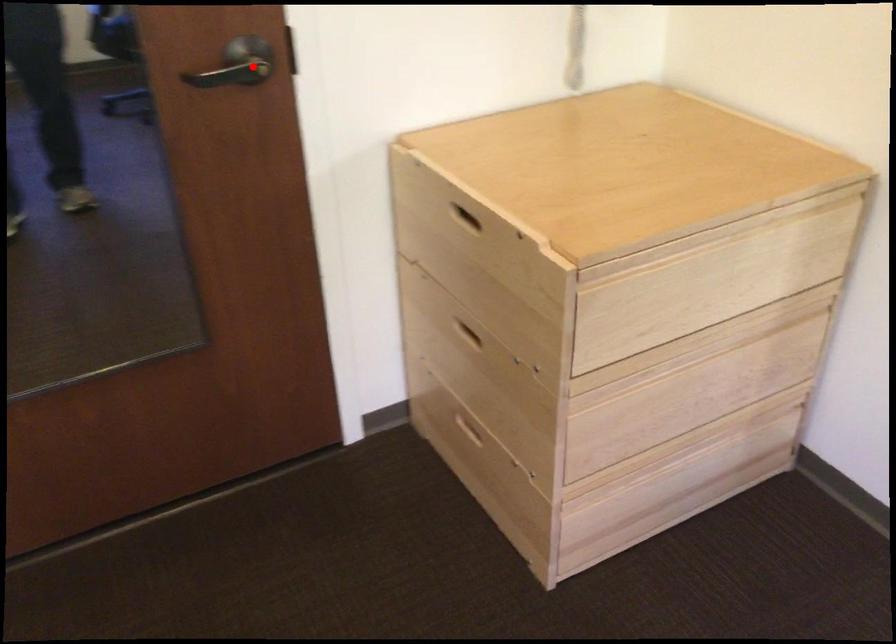
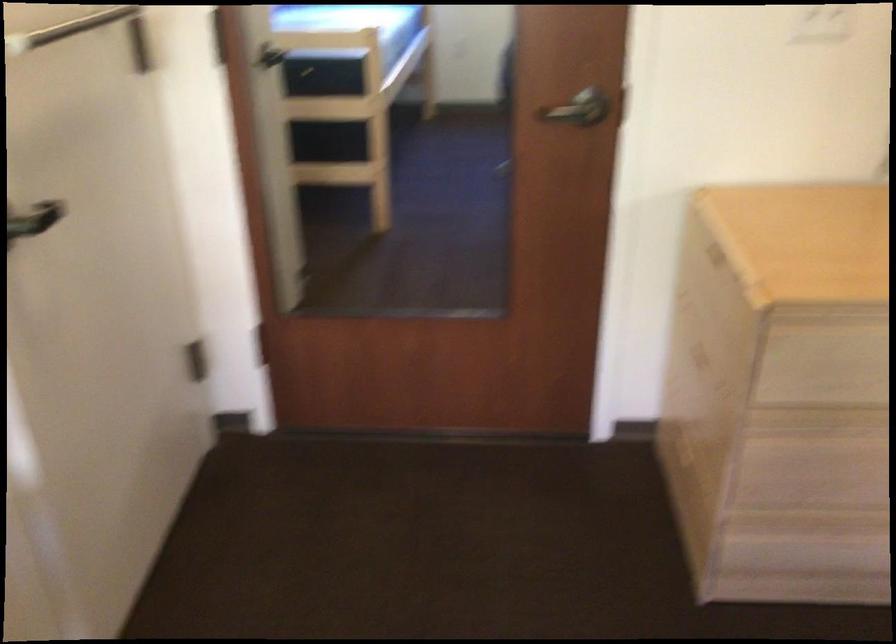
In the second image, find the point that corresponds to the highlighted location in the first image.

(583, 111)